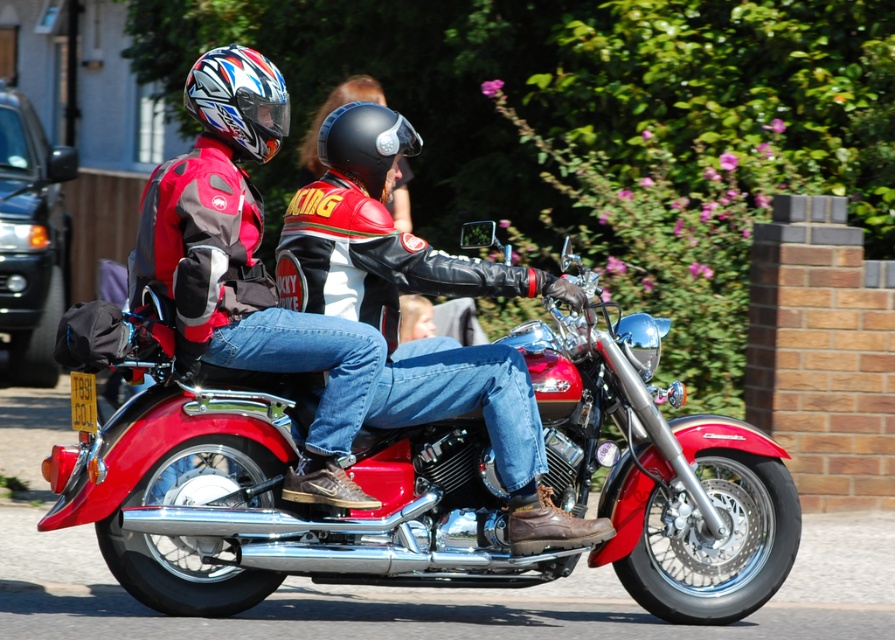
Question: Where is matte black helmet at upper left located in relation to shiny multicolored helmet at upper left in the image?

Choices:
 (A) right
 (B) left

Answer: (B)

Question: Among these objects, which one is nearest to the camera?

Choices:
 (A) matte black helmet at upper left
 (B) shiny chrome motorcycle at center

Answer: (B)

Question: Does shiny chrome motorcycle at center appear under matte black helmet at upper left?

Choices:
 (A) no
 (B) yes

Answer: (B)

Question: Does shiny multicolored helmet at upper left come behind black matte helmet at center?

Choices:
 (A) yes
 (B) no

Answer: (B)

Question: Which object is closer to the camera taking this photo?

Choices:
 (A) shiny multicolored helmet at upper left
 (B) shiny chrome motorcycle at center

Answer: (B)

Question: Which object is farther from the camera taking this photo?

Choices:
 (A) shiny multicolored helmet at upper left
 (B) shiny chrome motorcycle at center
 (C) matte black helmet at upper left

Answer: (A)